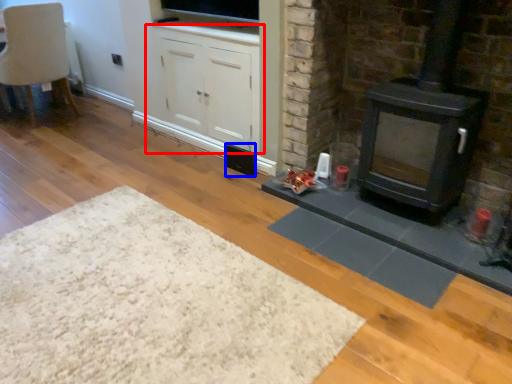
Question: Which object is closer to the camera taking this photo, cabinetry (highlighted by a red box) or speaker (highlighted by a blue box)?

Choices:
 (A) cabinetry
 (B) speaker

Answer: (A)